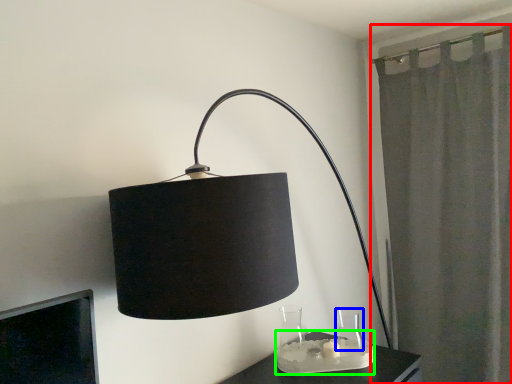
Question: Based on their relative distances, which object is farther from curtain (highlighted by a red box)? Choose from glass vase (highlighted by a blue box) and candle holder (highlighted by a green box).

Choices:
 (A) glass vase
 (B) candle holder

Answer: (B)